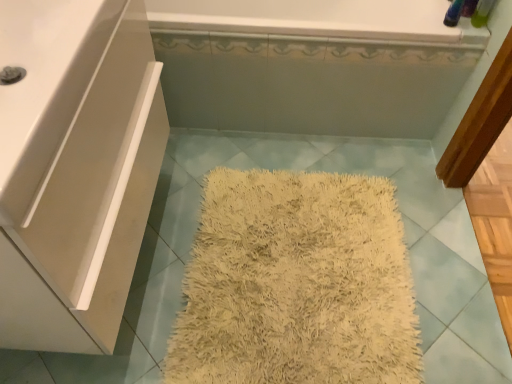
Question: From the image's perspective, does white glossy cabinet at left appear lower than white glossy sink at left?

Choices:
 (A) no
 (B) yes

Answer: (B)

Question: From the image's perspective, is white glossy cabinet at left on top of white glossy sink at left?

Choices:
 (A) yes
 (B) no

Answer: (B)

Question: Is white glossy cabinet at left oriented towards white glossy sink at left?

Choices:
 (A) no
 (B) yes

Answer: (A)

Question: Considering the relative sizes of white glossy cabinet at left and white glossy sink at left in the image provided, is white glossy cabinet at left shorter than white glossy sink at left?

Choices:
 (A) yes
 (B) no

Answer: (B)

Question: Is white glossy cabinet at left at the left side of white glossy sink at left?

Choices:
 (A) yes
 (B) no

Answer: (A)

Question: Considering their positions, is white glossy cabinet at left located in front of or behind white glossy bathtub at upper center?

Choices:
 (A) front
 (B) behind

Answer: (A)

Question: Does point click(96, 34) appear closer or farther from the camera than point click(331, 1)?

Choices:
 (A) farther
 (B) closer

Answer: (B)

Question: Considering the positions of white glossy cabinet at left and white glossy bathtub at upper center in the image, is white glossy cabinet at left wider or thinner than white glossy bathtub at upper center?

Choices:
 (A) thin
 (B) wide

Answer: (A)

Question: Is white glossy cabinet at left spatially inside white glossy bathtub at upper center, or outside of it?

Choices:
 (A) inside
 (B) outside

Answer: (B)

Question: Is white glossy sink at left inside the boundaries of white glossy cabinet at left, or outside?

Choices:
 (A) inside
 (B) outside

Answer: (A)

Question: From the image's perspective, relative to white glossy cabinet at left, is white glossy sink at left above or below?

Choices:
 (A) above
 (B) below

Answer: (A)

Question: Does point (62, 124) appear closer or farther from the camera than point (134, 61)?

Choices:
 (A) farther
 (B) closer

Answer: (B)

Question: In terms of height, does white glossy sink at left look taller or shorter compared to white glossy cabinet at left?

Choices:
 (A) short
 (B) tall

Answer: (A)

Question: From their relative heights in the image, would you say white glossy bathtub at upper center is taller or shorter than white glossy sink at left?

Choices:
 (A) tall
 (B) short

Answer: (A)

Question: Would you say white glossy bathtub at upper center is inside or outside white glossy sink at left?

Choices:
 (A) outside
 (B) inside

Answer: (A)